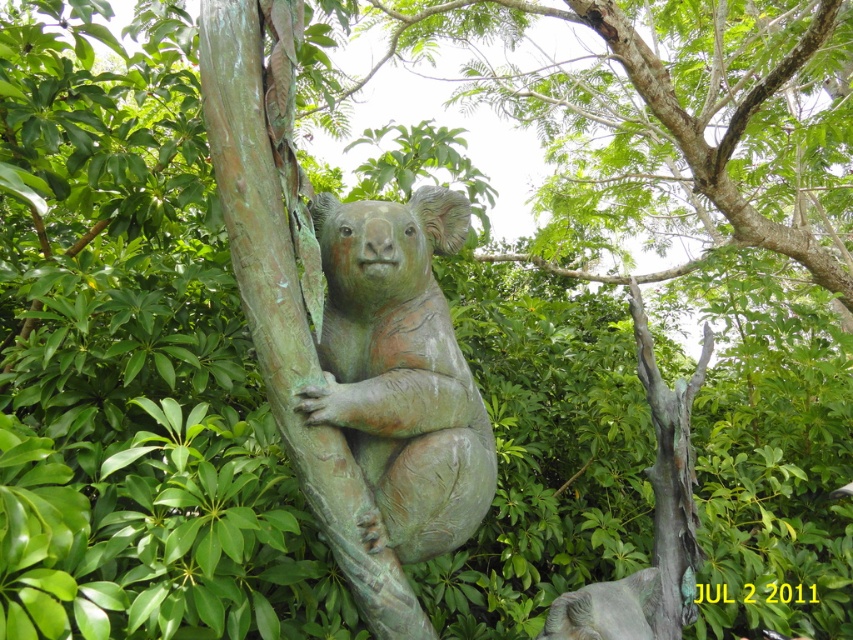
Question: Can you confirm if green patina bronze koala at center is positioned below green patina tree at center?

Choices:
 (A) no
 (B) yes

Answer: (A)

Question: Can you confirm if green patina bronze koala at center is smaller than green patina bear at center?

Choices:
 (A) no
 (B) yes

Answer: (B)

Question: Is green patina bronze koala at center further to the viewer compared to green patina tree at center?

Choices:
 (A) no
 (B) yes

Answer: (A)

Question: Which is farther from the green patina tree at center?

Choices:
 (A) green patina bronze koala at center
 (B) green patina bear at center

Answer: (B)

Question: Which object is the farthest from the green patina bronze koala at center?

Choices:
 (A) green patina tree at center
 (B) green patina bear at center

Answer: (A)

Question: Which object is farther from the camera taking this photo?

Choices:
 (A) green patina bronze koala at center
 (B) green patina bear at center
 (C) green patina tree at center

Answer: (C)